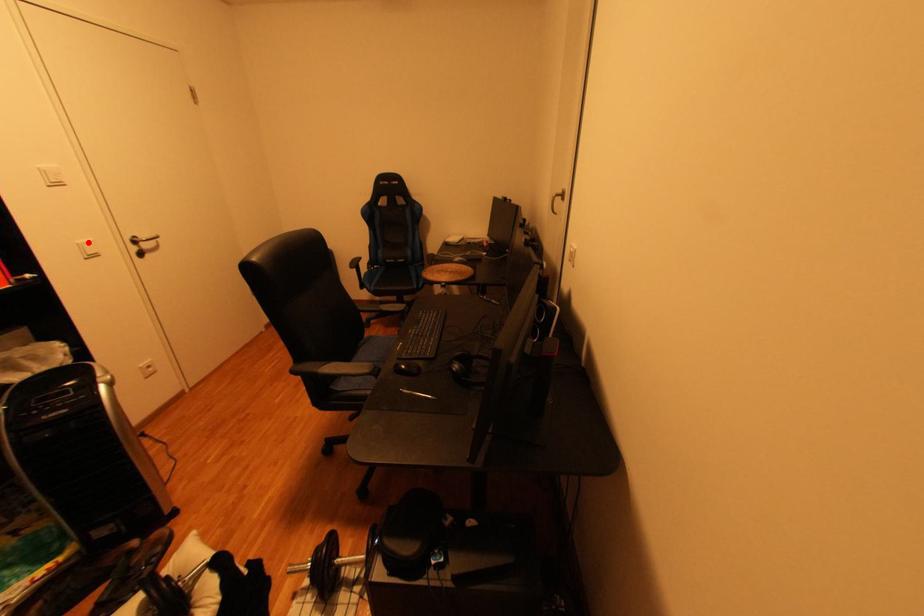
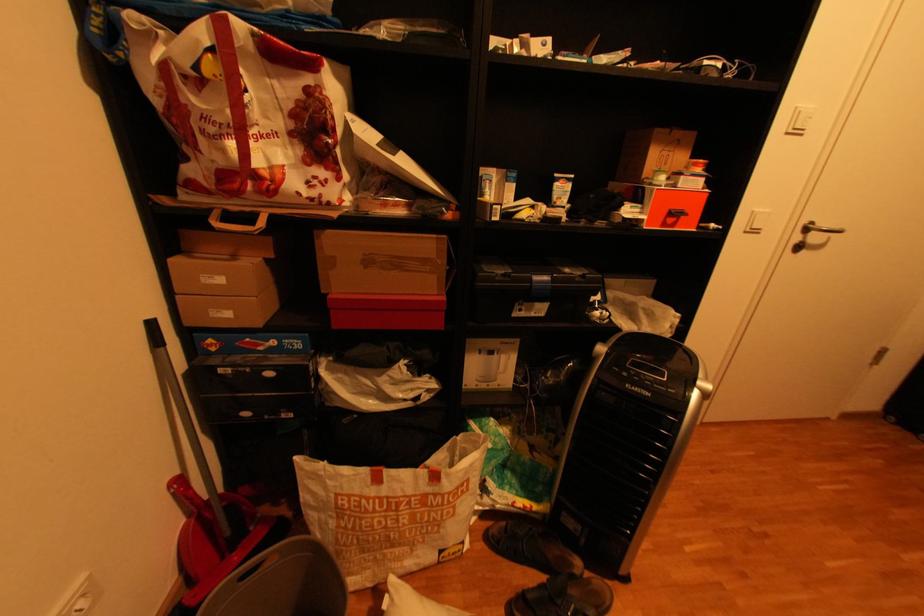
Question: I am providing you with two images of the same scene from different viewpoints. Image1 has a red point marked. In image2, the corresponding 3D location appears at what relative position? Reply with the corresponding letter.

Choices:
 (A) Closer
 (B) Farther

Answer: (A)